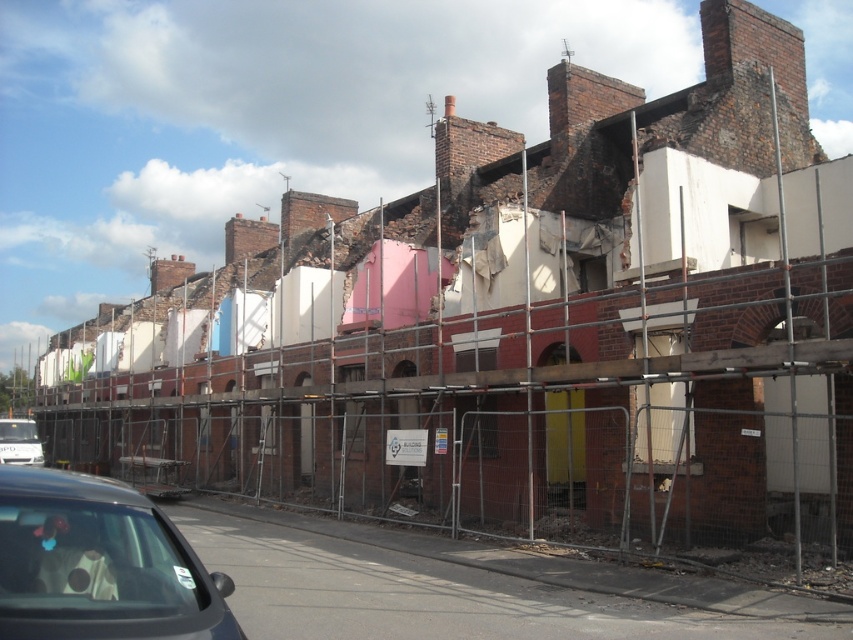
Who is more forward, (x=88, y=525) or (x=10, y=458)?

Point (x=88, y=525)

Which of these two, black glossy car at lower left or white matte van at lower left, stands taller?

black glossy car at lower left

Measure the distance between black glossy car at lower left and camera.

black glossy car at lower left is 4.18 meters from camera.

The image size is (853, 640). In order to click on black glossy car at lower left in this screenshot , I will do `click(99, 563)`.